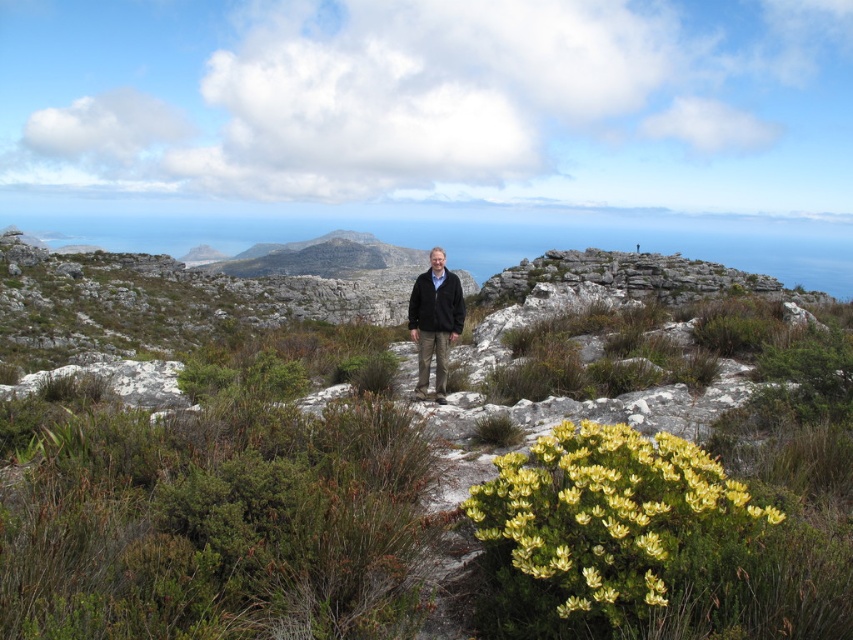
Is yellow matte flower at center-right further to the viewer compared to dark brown leather jacket at center?

No, yellow matte flower at center-right is in front of dark brown leather jacket at center.

Is yellow matte flower at center-right to the left of dark brown leather jacket at center from the viewer's perspective?

No, yellow matte flower at center-right is not to the left of dark brown leather jacket at center.

Identify the location of yellow matte flower at center-right. This screenshot has height=640, width=853. (614, 515).

Find the location of a particular element. yellow matte flower at center-right is located at coordinates (614, 515).

Who is more distant from viewer, (537, 468) or (450, 298)?

The point (450, 298) is behind.

Is yellow matte flower at center-right smaller than black fleece jacket at center?

Correct, yellow matte flower at center-right occupies less space than black fleece jacket at center.

Is point (550, 564) more distant than point (416, 298)?

No, (550, 564) is in front of (416, 298).

This screenshot has width=853, height=640. In order to click on yellow matte flower at center-right in this screenshot , I will do `click(614, 515)`.

Does green leafy shrub at center have a greater width compared to yellow matte flower at center-right?

Yes.

Can you confirm if green leafy shrub at center is positioned below yellow matte flower at center-right?

Actually, green leafy shrub at center is above yellow matte flower at center-right.

Is point (732, 486) positioned in front of point (701, 452)?

Yes, point (732, 486) is closer to viewer.

I want to click on green leafy shrub at center, so click(x=213, y=515).